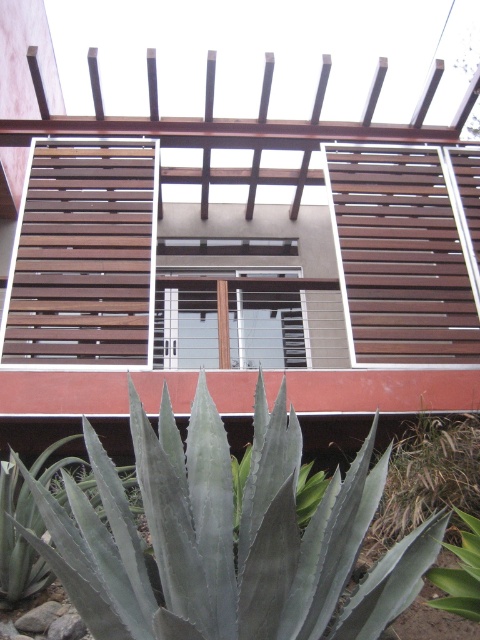
Question: Can you confirm if green leafy plant at lower right is thinner than green leafy plant at lower left?

Choices:
 (A) yes
 (B) no

Answer: (B)

Question: Can you confirm if green spiky plant at lower center is positioned to the right of green leafy plant at lower right?

Choices:
 (A) yes
 (B) no

Answer: (B)

Question: Can you confirm if green spiky plant at lower center is bigger than green leafy plant at lower right?

Choices:
 (A) yes
 (B) no

Answer: (A)

Question: Which point appears closest to the camera in this image?

Choices:
 (A) (452, 593)
 (B) (1, 595)
 (C) (460, 472)
 (D) (383, 609)

Answer: (D)

Question: Which object appears closest to the camera in this image?

Choices:
 (A) green leafy plant at lower right
 (B) green spiky plant at lower center

Answer: (B)

Question: Among these points, which one is farthest from the camera?

Choices:
 (A) (428, 440)
 (B) (475, 568)
 (C) (55, 570)

Answer: (A)